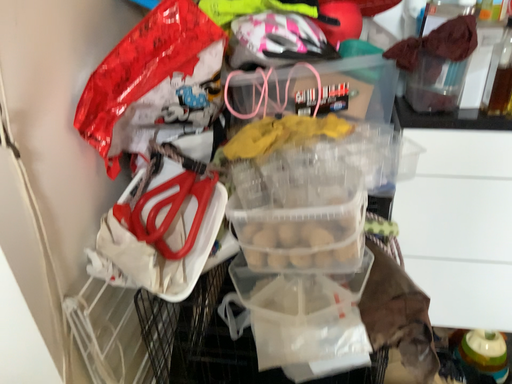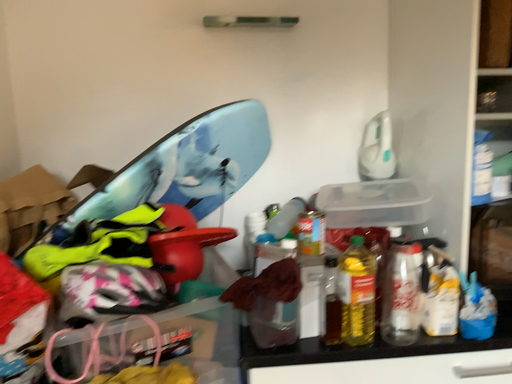
Question: Which way did the camera rotate in the video?

Choices:
 (A) rotated left
 (B) rotated right

Answer: (B)